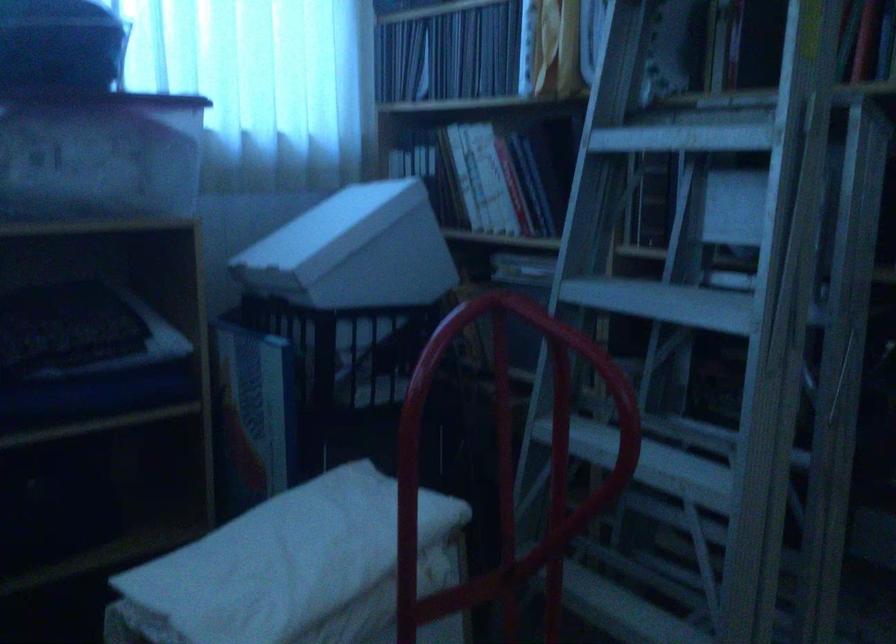
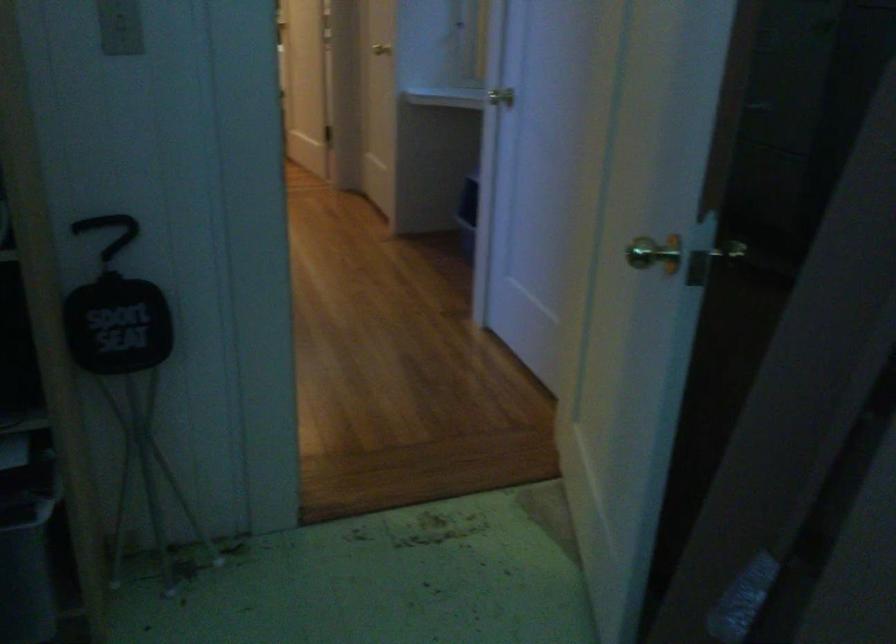
The images are taken continuously from a first-person perspective. In which direction is your viewpoint rotating?

The camera's rotation is toward right-down.